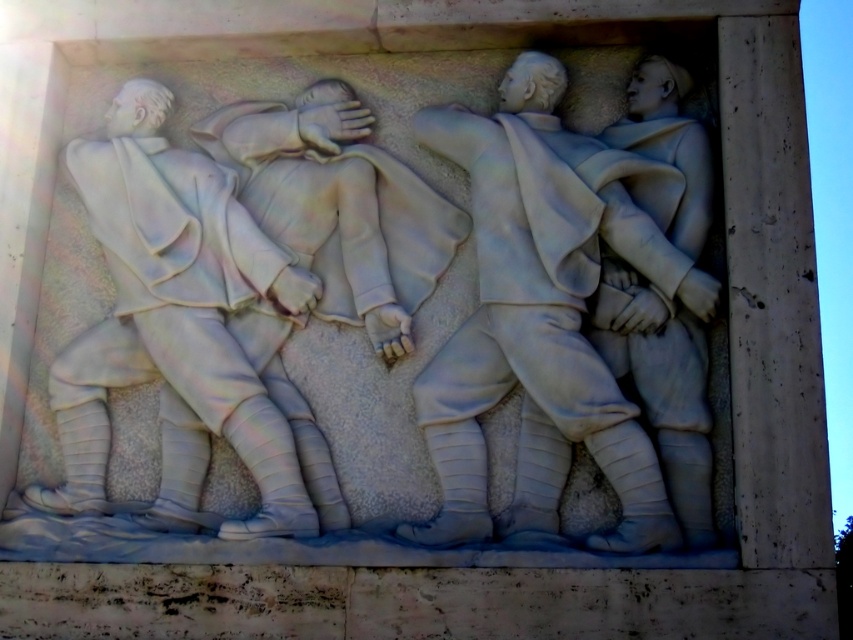
Between white marble figure at center and white marble figure at left, which one is positioned higher?

white marble figure at center is above.

Image resolution: width=853 pixels, height=640 pixels. Identify the location of white marble figure at center. (554, 310).